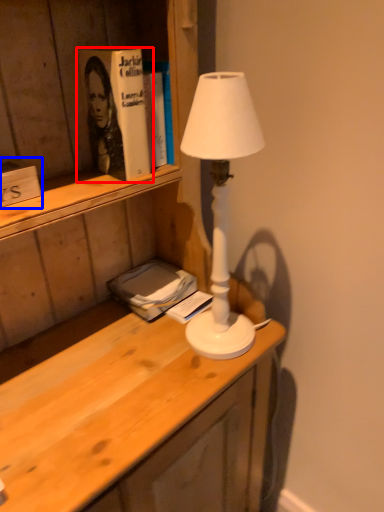
Question: Which object is further to the camera taking this photo, paperback book (highlighted by a red box) or book (highlighted by a blue box)?

Choices:
 (A) paperback book
 (B) book

Answer: (A)